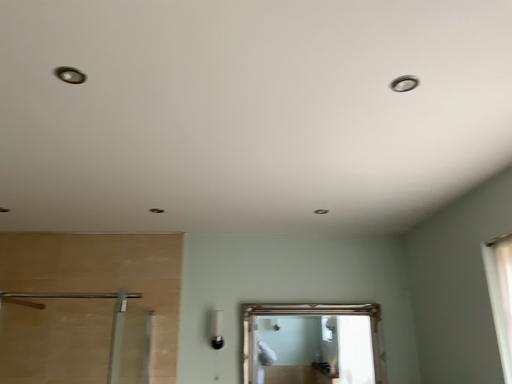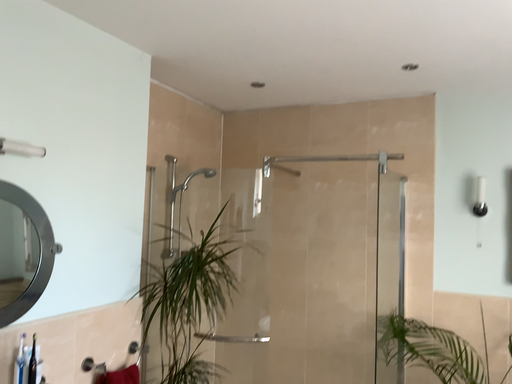
Question: Which way did the camera rotate in the video?

Choices:
 (A) rotated left
 (B) rotated right

Answer: (A)